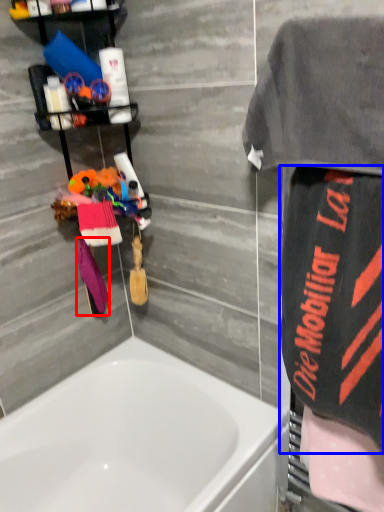
Question: Which of the following is the farthest to the observer, beach towel (highlighted by a red box) or beach towel (highlighted by a blue box)?

Choices:
 (A) beach towel
 (B) beach towel

Answer: (A)